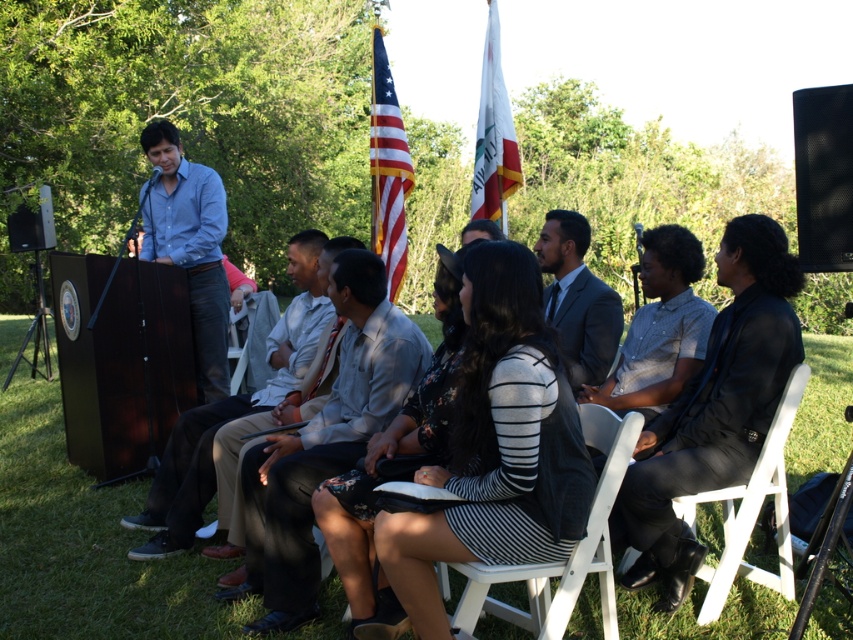
Does light gray shirt at center have a larger size compared to gray suit at center?

Indeed, light gray shirt at center has a larger size compared to gray suit at center.

Can you confirm if light gray shirt at center is positioned to the right of gray suit at center?

In fact, light gray shirt at center is to the left of gray suit at center.

Locate an element on the screen. light gray shirt at center is located at coordinates (323, 444).

Find the location of a particular element. The width and height of the screenshot is (853, 640). light gray shirt at center is located at coordinates (323, 444).

Based on the photo, which is below, light gray shirt at center or light brown pants at center?

light gray shirt at center is below.

Is point (389, 365) less distant than point (202, 499)?

Yes.

Locate an element on the screen. The image size is (853, 640). light gray shirt at center is located at coordinates (323, 444).

From the picture: Can you confirm if white wood chair at lower right is positioned above gray suit at center?

Actually, white wood chair at lower right is below gray suit at center.

What do you see at coordinates (751, 509) in the screenshot? This screenshot has width=853, height=640. I see `white wood chair at lower right` at bounding box center [751, 509].

This screenshot has height=640, width=853. Find the location of `white wood chair at lower right`. white wood chair at lower right is located at coordinates (751, 509).